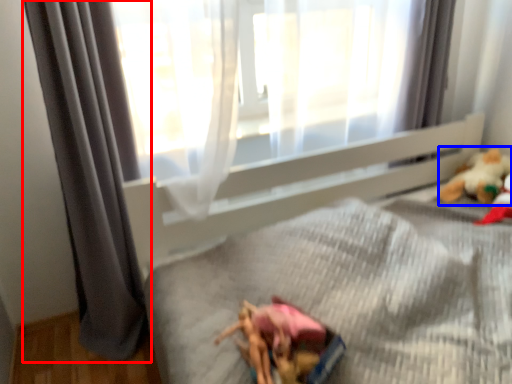
Question: Among these objects, which one is nearest to the camera, curtain (highlighted by a red box) or toy (highlighted by a blue box)?

Choices:
 (A) curtain
 (B) toy

Answer: (A)